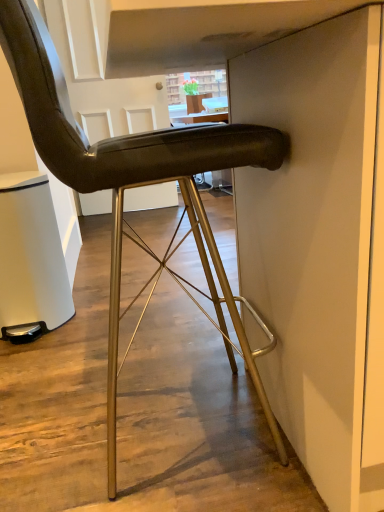
Where is `vacant region to the left of matte black chair at center`? The width and height of the screenshot is (384, 512). vacant region to the left of matte black chair at center is located at coordinates (44, 416).